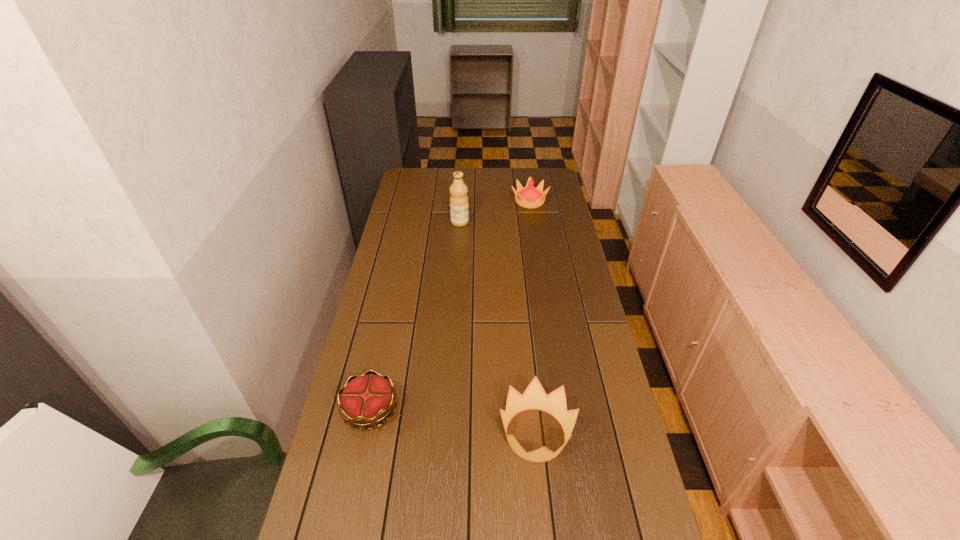
I want to click on the third object from right to left, so pyautogui.click(x=459, y=212).

At what (x,y) coordinates should I click in order to perform the action: click on the tallest object. Please return your answer as a coordinate pair (x, y). This screenshot has height=540, width=960. Looking at the image, I should click on (459, 212).

I want to click on the farthest crown, so click(529, 197).

You are a GUI agent. You are given a task and a screenshot of the screen. Output one action in this format:
    pyautogui.click(x=<x>, y=<y>)
    Task: Click on the leftmost crown
    
    Given the screenshot: What is the action you would take?
    pyautogui.click(x=365, y=400)

At what (x,y) coordinates should I click in order to perform the action: click on the shortest object. Please return your answer as a coordinate pair (x, y). The width and height of the screenshot is (960, 540). Looking at the image, I should click on (365, 400).

Where is `free region located 0.140m on the label of the third object from right to left`? free region located 0.140m on the label of the third object from right to left is located at coordinates (501, 222).

The image size is (960, 540). I want to click on blank area located 0.270m on the front of the farthest crown, so click(x=538, y=248).

Find the location of `blank space located on the back of the shortest object`. blank space located on the back of the shortest object is located at coordinates (391, 313).

Find the location of `object that is at the far edge`. object that is at the far edge is located at coordinates (529, 197).

Locate an element on the screen. object at the left edge is located at coordinates (365, 400).